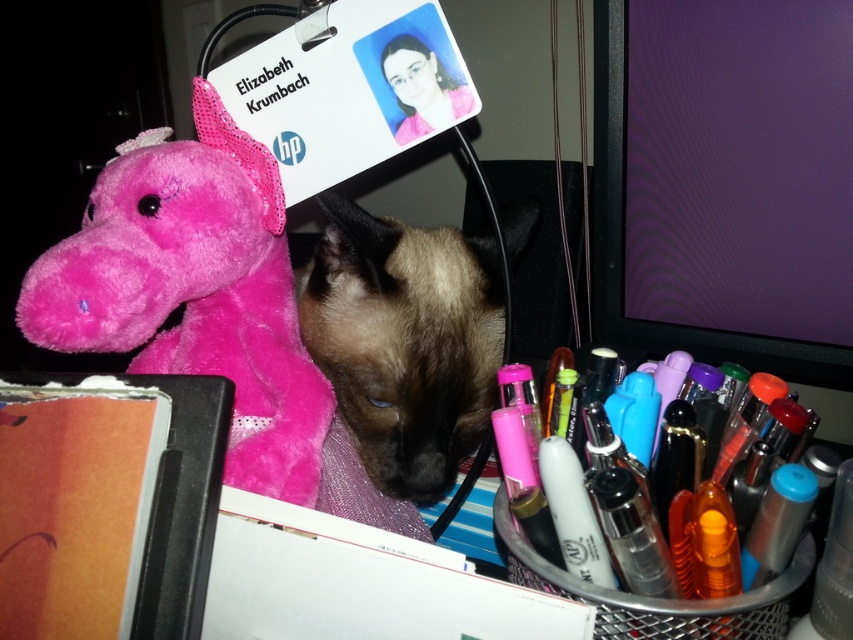
You are organizing the desk and need to move the brown fur cat at center. To make space, you want to move it closer to the purple glossy monitor at upper right. Is the monitor already positioned closer to you than the cat?

The purple glossy monitor at upper right is further to the viewer than the brown fur cat at center, so the cat is actually closer to you. Moving the cat towards the monitor would mean placing it farther away from you.

Based on the coordinates provided, which object is located at point (x=194, y=291)?

The fuzzy pink stuffed animal at left is located at point (x=194, y=291).